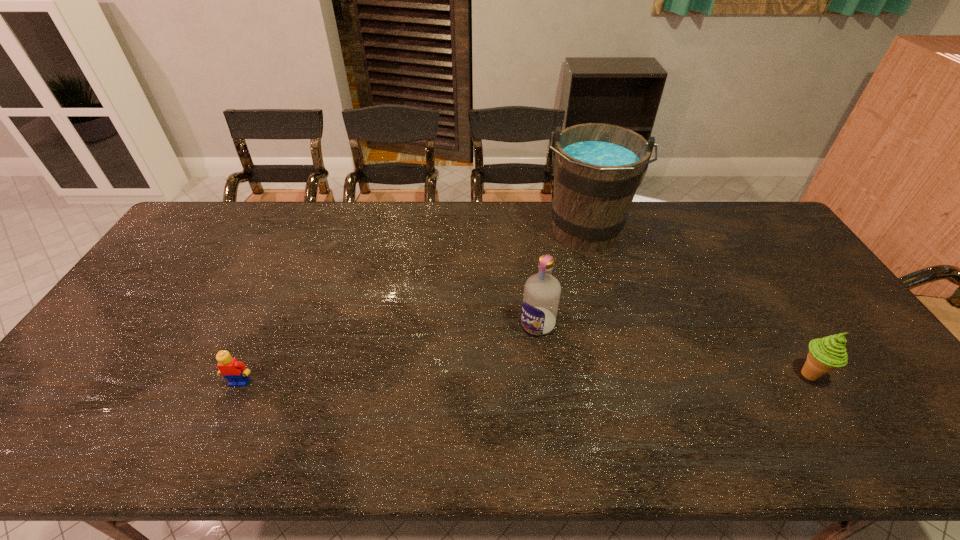
Identify the location of the leftmost object. (235, 371).

Locate an element on the screen. This screenshot has width=960, height=540. Lego is located at coordinates (235, 371).

This screenshot has width=960, height=540. I want to click on the third tallest object, so click(x=825, y=354).

Where is `icecream`? This screenshot has height=540, width=960. icecream is located at coordinates (825, 354).

Image resolution: width=960 pixels, height=540 pixels. I want to click on the tallest object, so click(597, 168).

Image resolution: width=960 pixels, height=540 pixels. I want to click on wine bucket, so click(597, 168).

Identify the location of the second farthest object. (540, 301).

This screenshot has height=540, width=960. I want to click on vodka, so pos(540,301).

Locate an element on the screen. This screenshot has height=540, width=960. free region located on the back of the rightmost object is located at coordinates (759, 296).

Identify the location of vacant space located 0.310m with a handle on the side of the farthest object. (570, 340).